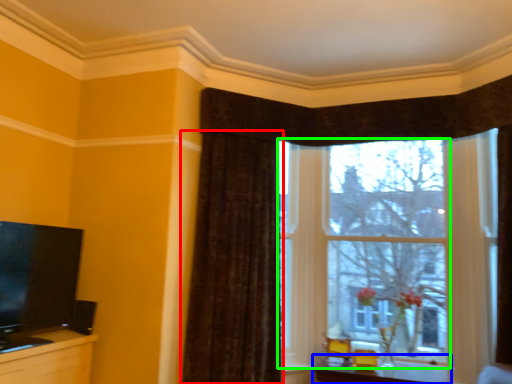
Question: Based on their relative distances, which object is nearer to curtain (highlighted by a red box)? Choose from table (highlighted by a blue box) and window (highlighted by a green box).

Choices:
 (A) table
 (B) window

Answer: (B)